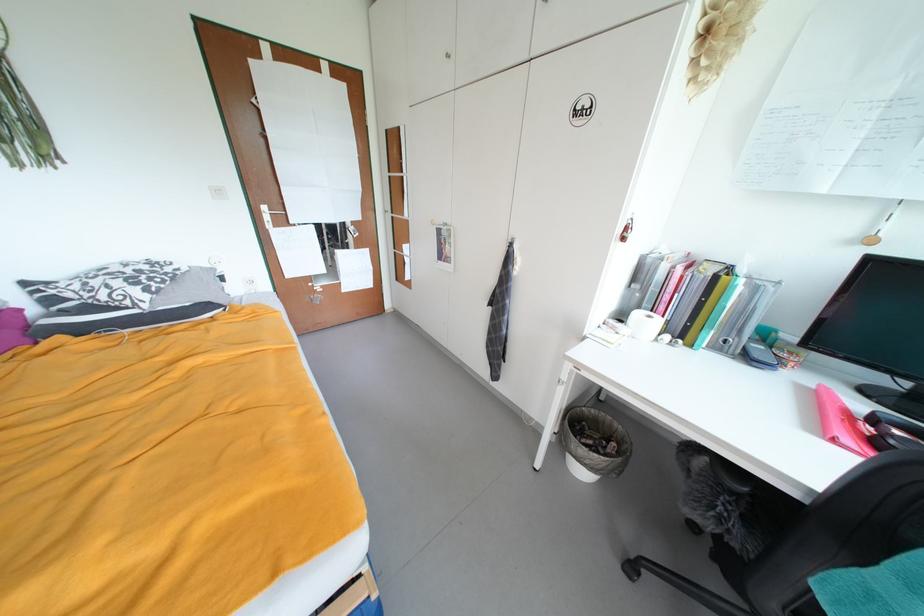
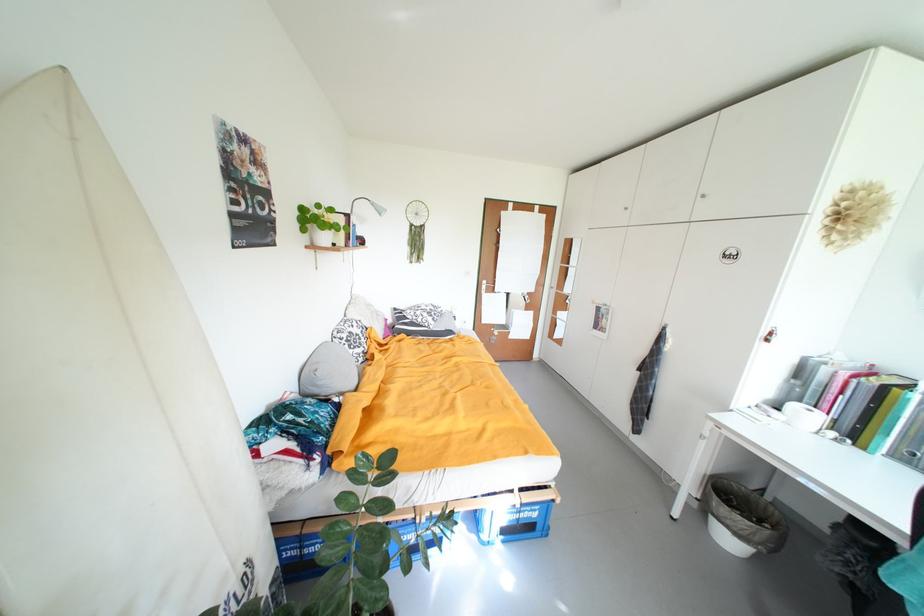
In the second image, find the point that corresponds to the point at 284,227 in the first image.

(494, 294)